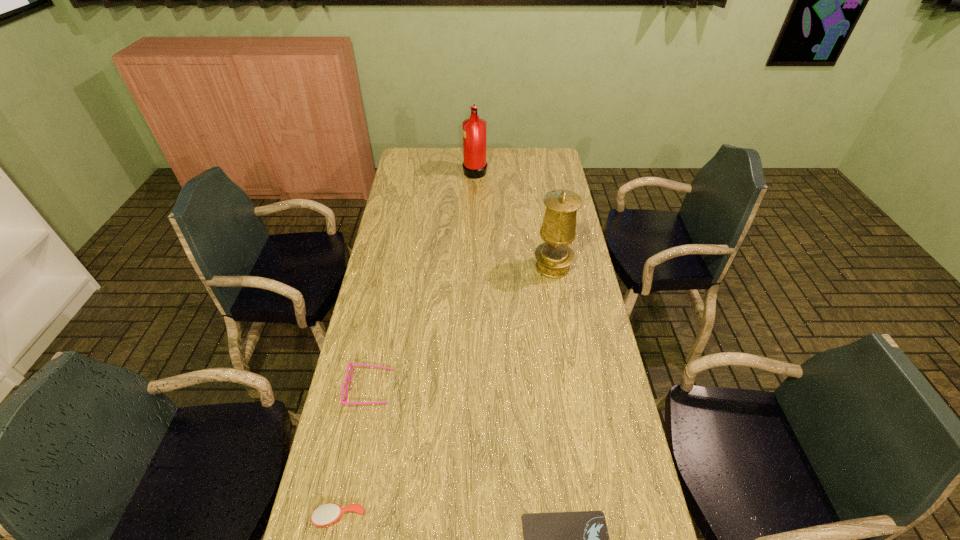
Locate an element on the screen. empty location between the third tallest object and the fourth tallest object is located at coordinates (355, 453).

In order to click on free point between the third object from left to right and the third farthest object in this screenshot , I will do `click(422, 279)`.

I want to click on object that is the third closest to the fire extinguisher, so click(x=580, y=539).

This screenshot has height=540, width=960. In order to click on the fourth closest object to the third shortest object in this screenshot , I will do `click(474, 128)`.

The image size is (960, 540). What are the coordinates of `free spot that satisfies the following two spatial constraints: 1. at the spray nozzle of the fourth nearest object; 2. on the right side of the fire extinguisher` in the screenshot? It's located at (473, 267).

What are the coordinates of `blank space that satisfies the following two spatial constraints: 1. at the spray nozzle of the farthest object; 2. on the front side of the second shortest object` in the screenshot? It's located at (469, 517).

The width and height of the screenshot is (960, 540). I want to click on free location that satisfies the following two spatial constraints: 1. at the spray nozzle of the second farthest object; 2. on the right side of the farthest object, so click(x=473, y=267).

Where is `vacant space that satisfies the following two spatial constraints: 1. on the back side of the second farthest object; 2. at the spray nozzle of the third object from left to right`? The image size is (960, 540). vacant space that satisfies the following two spatial constraints: 1. on the back side of the second farthest object; 2. at the spray nozzle of the third object from left to right is located at coordinates (537, 170).

Find the location of a particular element. This screenshot has width=960, height=540. free space that satisfies the following two spatial constraints: 1. on the front side of the oil lamp; 2. on the arms of the spectacles is located at coordinates (573, 388).

I want to click on free space in the image that satisfies the following two spatial constraints: 1. at the spray nozzle of the farthest object; 2. on the back side of the oil lamp, so click(473, 267).